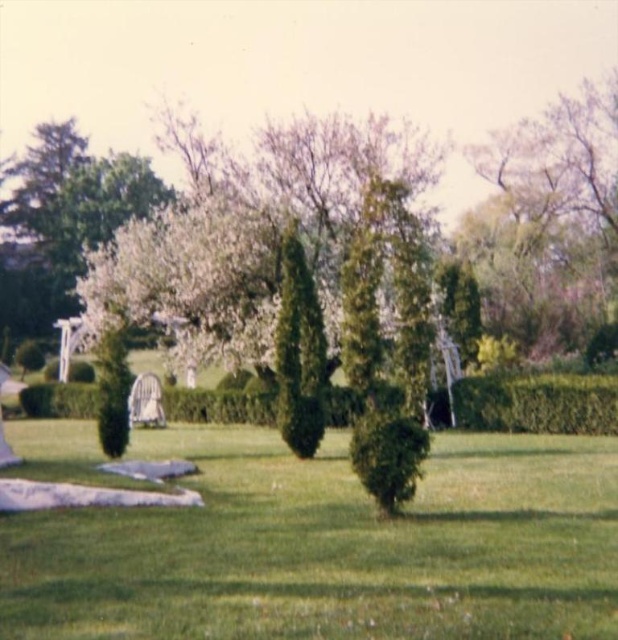
Can you confirm if green leafy tree at upper right is positioned to the right of green leafy hedge at center?

Indeed, green leafy tree at upper right is positioned on the right side of green leafy hedge at center.

Where is `green leafy tree at upper right`? green leafy tree at upper right is located at coordinates (556, 214).

Which is behind, point (577, 124) or point (614, 401)?

The point (577, 124) is more distant.

Identify the location of green leafy tree at upper right. (556, 214).